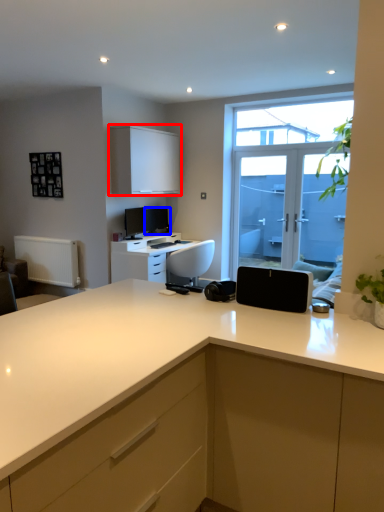
Question: Among these objects, which one is nearest to the camera, cabinetry (highlighted by a red box) or computer monitor (highlighted by a blue box)?

Choices:
 (A) cabinetry
 (B) computer monitor

Answer: (A)